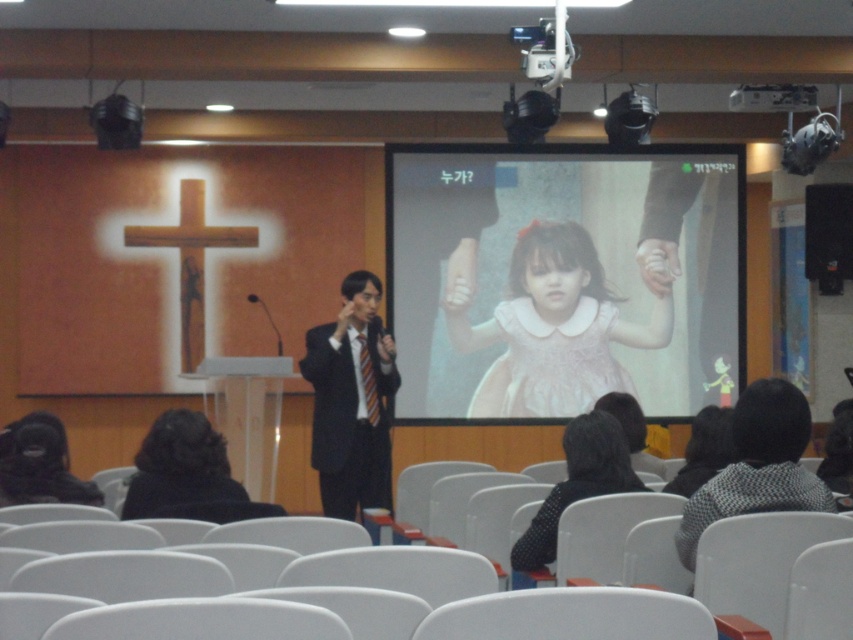
Question: Which point is farther to the camera?

Choices:
 (A) (715, 184)
 (B) (728, 106)
 (C) (4, 140)

Answer: (A)

Question: Is matte pink dress at center behind black dotted blouse at lower center?

Choices:
 (A) yes
 (B) no

Answer: (A)

Question: Does black dotted blouse at lower center appear over black plastic speaker at right?

Choices:
 (A) yes
 (B) no

Answer: (B)

Question: Estimate the real-world distances between objects in this image. Which object is closer to the matte pink dress at center?

Choices:
 (A) black plastic speaker at right
 (B) matte black suit at center
 (C) metallic projector at upper center
 (D) black suit at center

Answer: (A)

Question: Is matte pink dress at center closer to the viewer compared to metallic projector at upper center?

Choices:
 (A) yes
 (B) no

Answer: (B)

Question: Based on their relative distances, which object is nearer to the matte black suit at center?

Choices:
 (A) black suit at center
 (B) metallic projector at upper center
 (C) black dotted blouse at lower center
 (D) pink satin dress at center

Answer: (A)